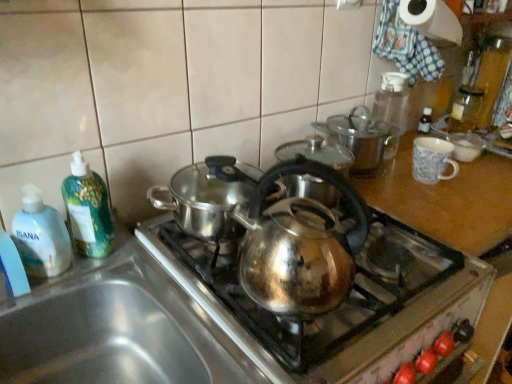
This screenshot has width=512, height=384. Identify the location of vacant space to the right of translucent plastic soap dispenser at left, the fourth bottle from the right. (131, 271).